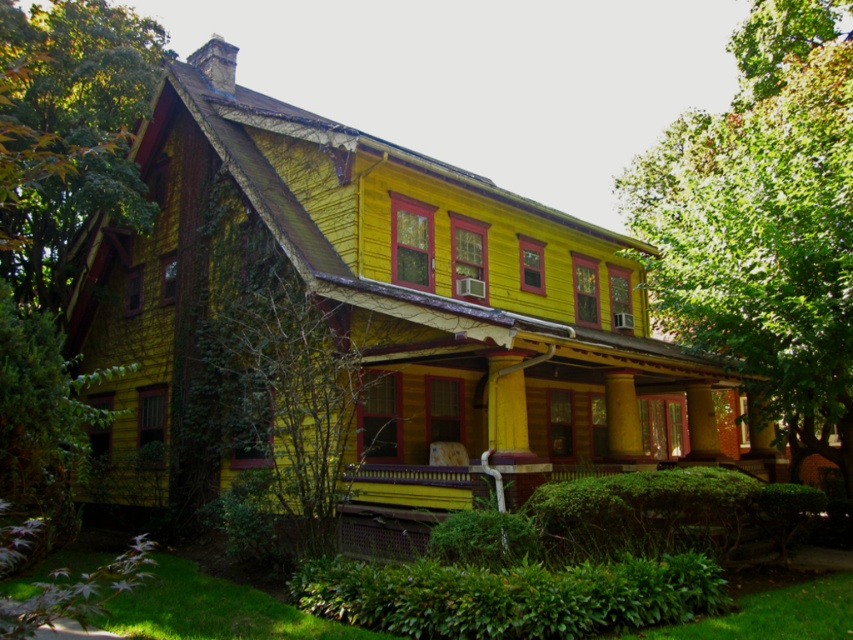
Question: Among these objects, which one is nearest to the camera?

Choices:
 (A) green leafy tree at upper right
 (B) green leafy tree at center
 (C) green leafy tree at left

Answer: (C)

Question: Which object is closer to the camera taking this photo?

Choices:
 (A) green leafy tree at center
 (B) green leafy tree at upper right

Answer: (A)

Question: Is green leafy tree at upper right to the right of green leafy tree at center from the viewer's perspective?

Choices:
 (A) no
 (B) yes

Answer: (B)

Question: In this image, where is green leafy tree at left located relative to green leafy tree at center?

Choices:
 (A) right
 (B) left

Answer: (B)

Question: Which object is positioned farthest from the green leafy tree at center?

Choices:
 (A) green leafy tree at left
 (B) green leafy tree at upper right

Answer: (B)

Question: Can you confirm if green leafy tree at upper right is positioned below green leafy tree at center?

Choices:
 (A) yes
 (B) no

Answer: (B)